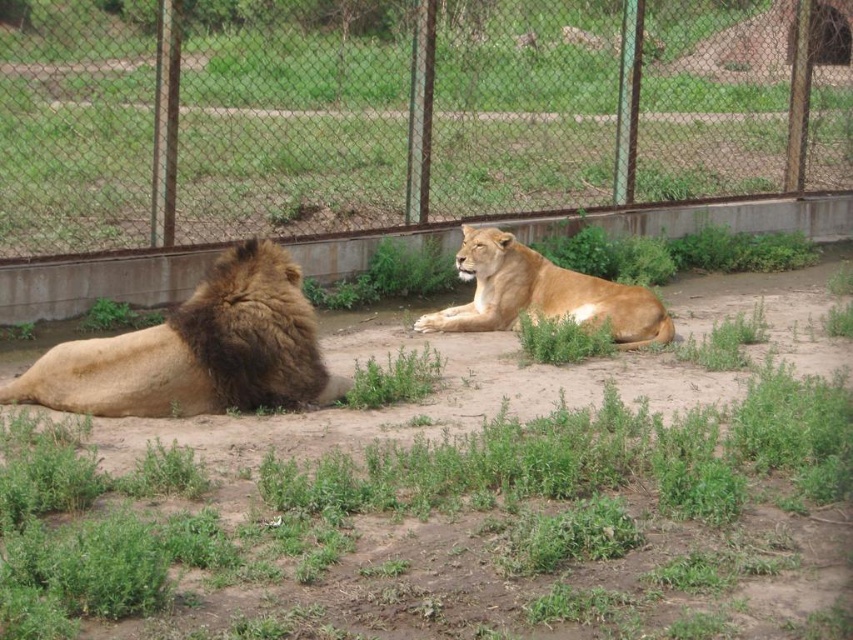
Question: Which point is closer to the camera?

Choices:
 (A) metal mesh fence at upper center
 (B) golden fur lion at left
 (C) golden fur lion at center

Answer: (B)

Question: Which point appears farthest from the camera in this image?

Choices:
 (A) pyautogui.click(x=585, y=292)
 (B) pyautogui.click(x=189, y=362)

Answer: (A)

Question: Can you confirm if golden fur lion at left is positioned above golden fur lion at center?

Choices:
 (A) no
 (B) yes

Answer: (A)

Question: Is golden fur lion at left behind golden fur lion at center?

Choices:
 (A) no
 (B) yes

Answer: (A)

Question: Which object appears farthest from the camera in this image?

Choices:
 (A) golden fur lion at left
 (B) golden fur lion at center
 (C) metal mesh fence at upper center

Answer: (C)

Question: Does golden fur lion at left appear over golden fur lion at center?

Choices:
 (A) no
 (B) yes

Answer: (A)